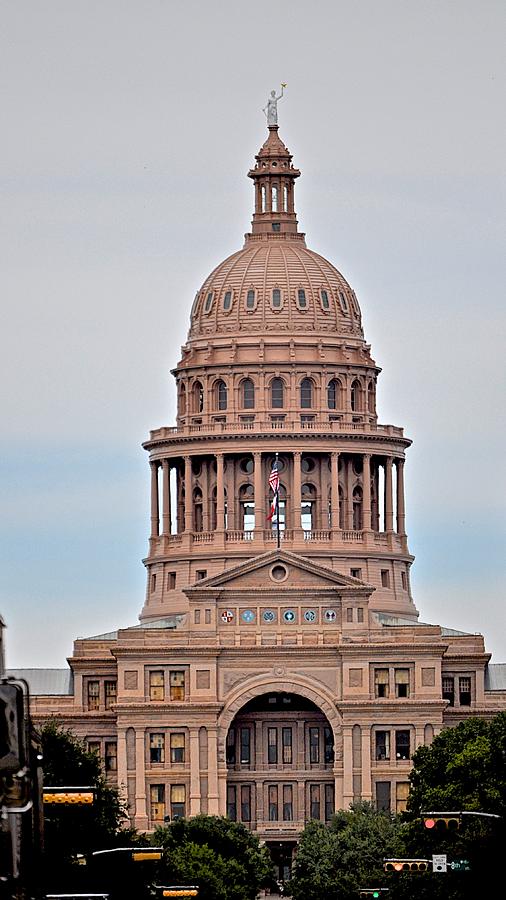
Identify the location of statue base. The width and height of the screenshot is (506, 900). (278, 158).